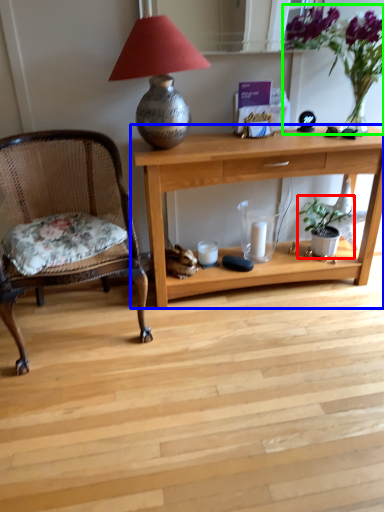
Question: Which object is the closest to the houseplant (highlighted by a red box)? Choose among these: desk (highlighted by a blue box) or floral arrangement (highlighted by a green box).

Choices:
 (A) desk
 (B) floral arrangement

Answer: (A)